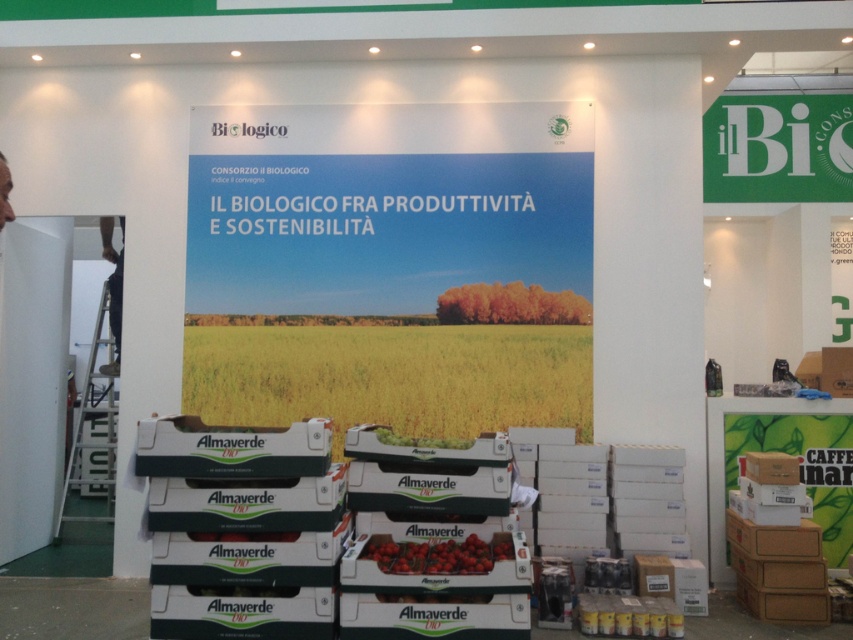
Which is behind, point (433, 572) or point (396, 440)?

Positioned behind is point (396, 440).

Who is more forward, (480,557) or (444,440)?

Point (480,557)

Where is `red matte tomatoes at center`? red matte tomatoes at center is located at coordinates (438, 554).